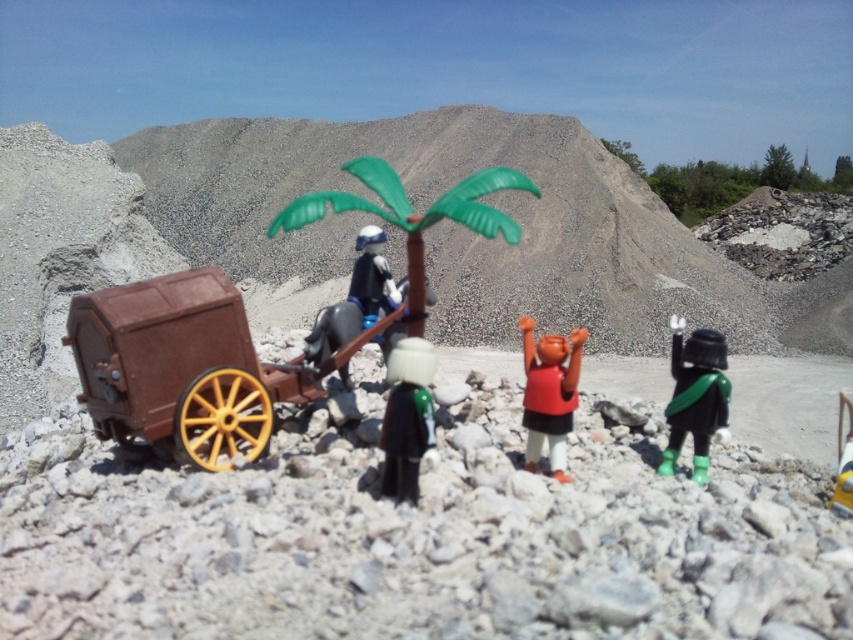
You are a photographer trying to capture a clear shot of both the shiny black helmet at center right and the glossy plastic figure at center. Based on their positions, which object should you focus on first to ensure both are in sharp focus?

The shiny black helmet at center right is below the glossy plastic figure at center. To ensure both are in sharp focus, you should focus on the glossy plastic figure at center first since it is farther away from the camera, allowing the depth of field to cover the helmet below it.

You are a photographer trying to capture the glossy plastic figure at center in your shot. The camera is positioned at the origin point. Which direction should you move the camera to align it with the figure?

The glossy plastic figure at center is located at point (372, 276), so you should move the camera to the right and upwards to align with it.

You are a visitor observing the miniature scene. You notice the glossy plastic figure at center and the yellow plastic toy at lower right. Which object is closer to the front of the scene?

The glossy plastic figure at center is positioned over the yellow plastic toy at lower right, so it is closer to the front of the scene.